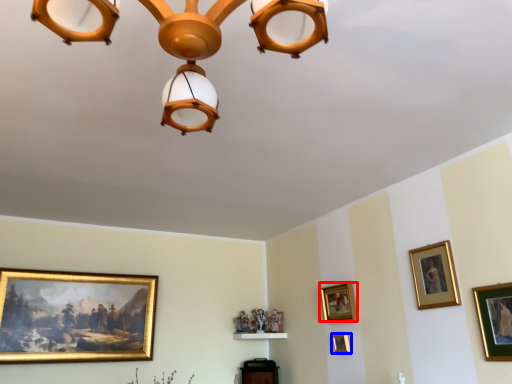
Question: Which object appears closest to the camera in this image, picture frame (highlighted by a red box) or picture frame (highlighted by a blue box)?

Choices:
 (A) picture frame
 (B) picture frame

Answer: (A)